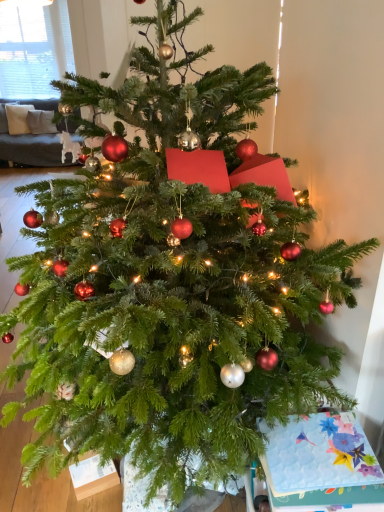
Question: Is white blinds at upper left touching floral paper card at lower right?

Choices:
 (A) yes
 (B) no

Answer: (B)

Question: From the image's perspective, is white blinds at upper left beneath floral paper card at lower right?

Choices:
 (A) yes
 (B) no

Answer: (B)

Question: From the image's perspective, is white blinds at upper left on floral paper card at lower right?

Choices:
 (A) no
 (B) yes

Answer: (B)

Question: Is white blinds at upper left in front of floral paper card at lower right?

Choices:
 (A) no
 (B) yes

Answer: (A)

Question: From a real-world perspective, is white blinds at upper left on floral paper card at lower right?

Choices:
 (A) no
 (B) yes

Answer: (B)

Question: Is white blinds at upper left not within floral paper card at lower right?

Choices:
 (A) yes
 (B) no

Answer: (A)

Question: Can you confirm if floral paper card at lower right is taller than white blinds at upper left?

Choices:
 (A) yes
 (B) no

Answer: (B)

Question: Is the position of floral paper card at lower right less distant than that of white blinds at upper left?

Choices:
 (A) no
 (B) yes

Answer: (B)

Question: Is floral paper card at lower right not near white blinds at upper left?

Choices:
 (A) yes
 (B) no

Answer: (A)

Question: Is the depth of floral paper card at lower right greater than that of white blinds at upper left?

Choices:
 (A) no
 (B) yes

Answer: (A)

Question: Considering the relative sizes of floral paper card at lower right and white blinds at upper left in the image provided, is floral paper card at lower right smaller than white blinds at upper left?

Choices:
 (A) no
 (B) yes

Answer: (B)

Question: Is floral paper card at lower right placed right next to white blinds at upper left?

Choices:
 (A) no
 (B) yes

Answer: (A)

Question: From a real-world perspective, is white blinds at upper left positioned above or below floral paper card at lower right?

Choices:
 (A) below
 (B) above

Answer: (B)